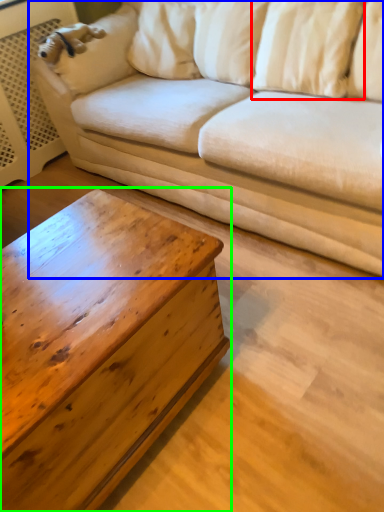
Question: Considering the real-world distances, which object is farthest from pillow (highlighted by a red box)? studio couch (highlighted by a blue box) or coffee table (highlighted by a green box)?

Choices:
 (A) studio couch
 (B) coffee table

Answer: (B)